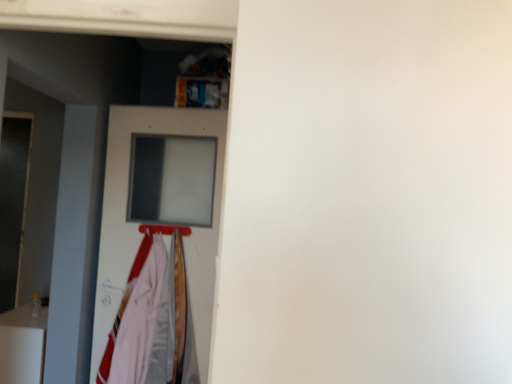
The height and width of the screenshot is (384, 512). Describe the element at coordinates (164, 229) in the screenshot. I see `metallic silver hanger at center` at that location.

The width and height of the screenshot is (512, 384). I want to click on white matte door at center, so click(x=161, y=205).

Locate an element on the screen. This screenshot has width=512, height=384. white glossy fridge at lower left is located at coordinates (23, 345).

Locate an element on the screen. white fabric at left is located at coordinates (111, 342).

How distant is white matte door at center from metallic silver hanger at center?

white matte door at center and metallic silver hanger at center are 11.38 inches apart from each other.

Is white matte door at center in contact with metallic silver hanger at center?

No, white matte door at center is not making contact with metallic silver hanger at center.

How many degrees apart are the facing directions of white matte door at center and metallic silver hanger at center?

The facing directions of white matte door at center and metallic silver hanger at center are 1.93 degrees apart.

Can you confirm if white matte door at center is taller than metallic silver hanger at center?

Correct, white matte door at center is much taller as metallic silver hanger at center.

Where is `clothing that appears below the white matte door at center (from the image's perspective)`? clothing that appears below the white matte door at center (from the image's perspective) is located at coordinates (111, 342).

Is white fabric at left in front of or behind white matte door at center in the image?

white fabric at left is behind white matte door at center.

From the picture: From the image's perspective, which object appears higher, white fabric at left or white matte door at center?

white matte door at center, from the image's perspective.

Is white fabric at left not close to white matte door at center?

No.

Based on the photo, is white glossy fridge at lower left located outside white matte door at center?

That's correct, white glossy fridge at lower left is outside of white matte door at center.

Considering the sizes of objects white glossy fridge at lower left and white matte door at center in the image provided, who is wider, white glossy fridge at lower left or white matte door at center?

With larger width is white glossy fridge at lower left.

From a real-world perspective, is white glossy fridge at lower left positioned over white matte door at center based on gravity?

No.

Which is farther, [40,373] or [103,206]?

Positioned behind is point [103,206].

Could you tell me if white glossy fridge at lower left is facing metallic silver hanger at center?

No, white glossy fridge at lower left is not oriented towards metallic silver hanger at center.

How different are the orientations of white glossy fridge at lower left and metallic silver hanger at center in degrees?

There is a 84.8-degree angle between the facing directions of white glossy fridge at lower left and metallic silver hanger at center.

The width and height of the screenshot is (512, 384). Find the location of `furniture below the metallic silver hanger at center (from the image's perspective)`. furniture below the metallic silver hanger at center (from the image's perspective) is located at coordinates (23, 345).

Does white glossy fridge at lower left have a greater height compared to metallic silver hanger at center?

Yes, white glossy fridge at lower left is taller than metallic silver hanger at center.

From the image's perspective, which is below, white fabric at left or white glossy fridge at lower left?

white glossy fridge at lower left, from the image's perspective.

Is white fabric at left facing away from white glossy fridge at lower left?

No, white fabric at left's orientation is not away from white glossy fridge at lower left.

Is white fabric at left not close to white glossy fridge at lower left?

white fabric at left is near white glossy fridge at lower left, not far away.

Measure the distance between white fabric at left and white glossy fridge at lower left.

A distance of 17.25 inches exists between white fabric at left and white glossy fridge at lower left.

Considering the sizes of objects white matte door at center and white fabric at left in the image provided, who is smaller, white matte door at center or white fabric at left?

Smaller between the two is white fabric at left.

Is white matte door at center positioned before white fabric at left?

Yes.

Which is correct: white matte door at center is inside white fabric at left, or outside of it?

white matte door at center lies outside white fabric at left.

Is white matte door at center aimed at white fabric at left?

Yes, white matte door at center is aimed at white fabric at left.

Which of these two, white fabric at left or metallic silver hanger at center, is wider?

white fabric at left.

Which of these two, white fabric at left or metallic silver hanger at center, stands taller?

Standing taller between the two is white fabric at left.

Is white fabric at left touching metallic silver hanger at center?

white fabric at left and metallic silver hanger at center are not in contact.

From the image's perspective, relative to metallic silver hanger at center, is white fabric at left above or below?

Based on their image positions, white fabric at left is located beneath metallic silver hanger at center.

Locate an element on the screen. Image resolution: width=512 pixels, height=384 pixels. hanger behind the white matte door at center is located at coordinates (164, 229).

At what (x,y) coordinates should I click in order to perform the action: click on clothing below the white matte door at center (from a real-world perspective). Please return your answer as a coordinate pair (x, y). The height and width of the screenshot is (384, 512). Looking at the image, I should click on (111, 342).

From the image, which object appears to be nearer to white glossy fridge at lower left, white fabric at left or metallic silver hanger at center?

white fabric at left is closer to white glossy fridge at lower left.

Looking at the image, which one is located further to white glossy fridge at lower left, white fabric at left or white matte door at center?

Among the two, white matte door at center is located further to white glossy fridge at lower left.

Estimate the real-world distances between objects in this image. Which object is further from white glossy fridge at lower left, white matte door at center or metallic silver hanger at center?

The object further to white glossy fridge at lower left is metallic silver hanger at center.

Estimate the real-world distances between objects in this image. Which object is further from white fabric at left, white glossy fridge at lower left or metallic silver hanger at center?

Among the two, white glossy fridge at lower left is located further to white fabric at left.

When comparing their distances from white matte door at center, does white glossy fridge at lower left or metallic silver hanger at center seem further?

white glossy fridge at lower left lies further to white matte door at center than the other object.

Looking at the image, which one is located further to white fabric at left, white matte door at center or metallic silver hanger at center?

Among the two, metallic silver hanger at center is located further to white fabric at left.

Considering their positions, is metallic silver hanger at center positioned closer to white matte door at center than white glossy fridge at lower left?

Among the two, metallic silver hanger at center is located nearer to white matte door at center.

Which object lies further to the anchor point metallic silver hanger at center, white matte door at center or white fabric at left?

The object further to metallic silver hanger at center is white matte door at center.

I want to click on clothing located between white glossy fridge at lower left and white matte door at center in the left-right direction, so click(111, 342).

Image resolution: width=512 pixels, height=384 pixels. What are the coordinates of `door between white glossy fridge at lower left and metallic silver hanger at center` in the screenshot? It's located at (161, 205).

You are a GUI agent. You are given a task and a screenshot of the screen. Output one action in this format:
    pyautogui.click(x=<x>, y=<y>)
    Task: Click on the clothing between white glossy fridge at lower left and metallic silver hanger at center from left to right
    This screenshot has width=512, height=384.
    Given the screenshot: What is the action you would take?
    pyautogui.click(x=111, y=342)

This screenshot has width=512, height=384. Find the location of `door that lies between metallic silver hanger at center and white fabric at left from top to bottom`. door that lies between metallic silver hanger at center and white fabric at left from top to bottom is located at coordinates (161, 205).